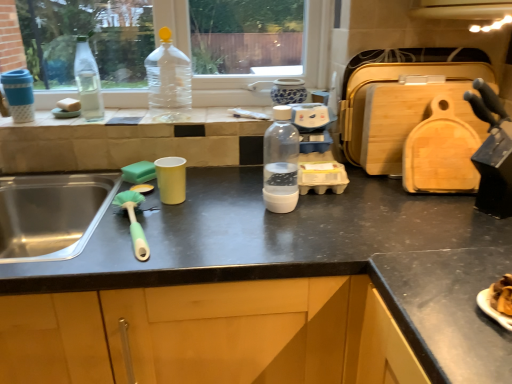
Identify the location of unoccupied area behind transparent plastic bottle at upper center, the 2th bottle from the back. This screenshot has height=384, width=512. (178, 107).